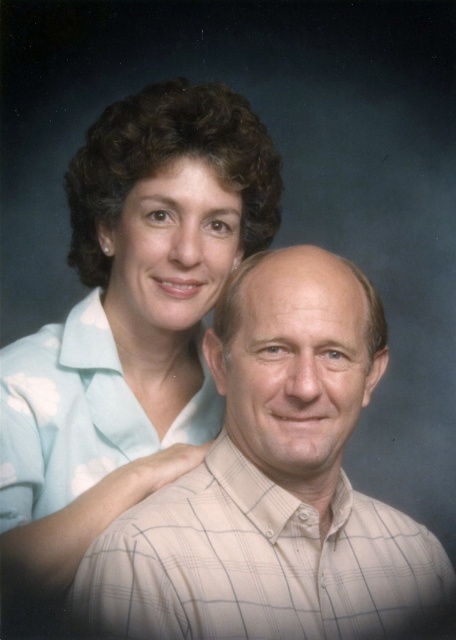
Is white checkered shirt at center taller than light blue fabric at upper left?

In fact, white checkered shirt at center may be shorter than light blue fabric at upper left.

Between white checkered shirt at center and light blue fabric at upper left, which one is positioned higher?

light blue fabric at upper left

Which is in front, point (219, 556) or point (160, 99)?

Point (219, 556) is in front.

At what (x,y) coordinates should I click in order to perform the action: click on white checkered shirt at center. Please return your answer as a coordinate pair (x, y). The width and height of the screenshot is (456, 640). Looking at the image, I should click on (273, 483).